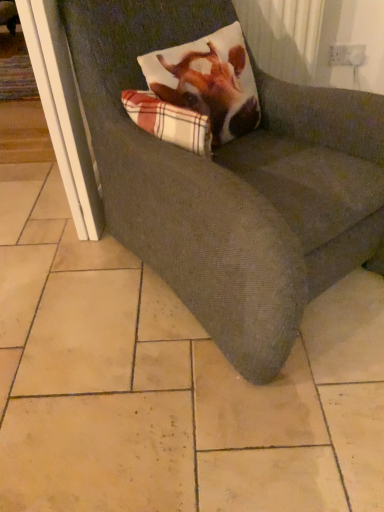
Describe the element at coordinates (169, 121) in the screenshot. I see `plaid fabric pillow at upper center` at that location.

Describe the element at coordinates (62, 112) in the screenshot. The height and width of the screenshot is (512, 384). I see `white plastic screen door at left` at that location.

In order to click on plaid fabric pillow at upper center in this screenshot , I will do `click(169, 121)`.

Are plaid fabric pillow at upper center and textured gray couch at center beside each other?

No, plaid fabric pillow at upper center is not with textured gray couch at center.

Is plaid fabric pillow at upper center to the right of textured gray couch at center from the viewer's perspective?

In fact, plaid fabric pillow at upper center is to the left of textured gray couch at center.

How many degrees apart are the facing directions of plaid fabric pillow at upper center and textured gray couch at center?

The angular difference between plaid fabric pillow at upper center and textured gray couch at center is 90 degrees.

Based on their sizes in the image, would you say plaid fabric pillow at upper center is bigger or smaller than textured gray couch at center?

In the image, plaid fabric pillow at upper center appears to be smaller than textured gray couch at center.

Are white plastic screen door at left and plaid fabric pillow at upper center located far from each other?

No, white plastic screen door at left is in close proximity to plaid fabric pillow at upper center.

Is white plastic screen door at left smaller than plaid fabric pillow at upper center?

No, white plastic screen door at left is not smaller than plaid fabric pillow at upper center.

Is point (96, 209) closer or farther from the camera than point (187, 131)?

Point (96, 209) appears to be farther away from the viewer than point (187, 131).

Is white plastic screen door at left taller or shorter than plaid fabric pillow at upper center?

white plastic screen door at left is taller than plaid fabric pillow at upper center.

Is plaid fabric pillow at upper center completely or partially outside of white plastic screen door at left?

plaid fabric pillow at upper center lies outside white plastic screen door at left's area.

Which is more to the left, plaid fabric pillow at upper center or white plastic screen door at left?

Positioned to the left is white plastic screen door at left.

Looking at their sizes, would you say plaid fabric pillow at upper center is wider or thinner than white plastic screen door at left?

plaid fabric pillow at upper center is thinner than white plastic screen door at left.

Which object is further away from the camera, plaid fabric pillow at upper center or white plastic screen door at left?

white plastic screen door at left is further from the camera.

Considering the relative sizes of white plastic screen door at left and textured gray couch at center in the image provided, is white plastic screen door at left wider than textured gray couch at center?

Incorrect, the width of white plastic screen door at left does not surpass that of textured gray couch at center.

Is white plastic screen door at left to the right of textured gray couch at center from the viewer's perspective?

In fact, white plastic screen door at left is to the left of textured gray couch at center.

From a real-world perspective, who is located lower, white plastic screen door at left or textured gray couch at center?

From a 3D spatial view, white plastic screen door at left is below.

Based on the photo, how different are the orientations of white plastic screen door at left and textured gray couch at center in degrees?

131 degrees separate the facing orientations of white plastic screen door at left and textured gray couch at center.

Which is in front, textured gray couch at center or plaid fabric pillow at upper center?

textured gray couch at center is more forward.

Is textured gray couch at center to the left of plaid fabric pillow at upper center from the viewer's perspective?

In fact, textured gray couch at center is to the right of plaid fabric pillow at upper center.

From a real-world perspective, is textured gray couch at center on plaid fabric pillow at upper center?

Incorrect, from a real-world perspective, textured gray couch at center is lower than plaid fabric pillow at upper center.

Between textured gray couch at center and plaid fabric pillow at upper center, which one has smaller width?

Thinner between the two is plaid fabric pillow at upper center.

Considering the points (234, 314) and (76, 147), which point is in front, point (234, 314) or point (76, 147)?

Positioned in front is point (234, 314).

At what (x,y) coordinates should I click in order to perform the action: click on chair in front of the white plastic screen door at left. Please return your answer as a coordinate pair (x, y). The image size is (384, 512). Looking at the image, I should click on (231, 183).

From the image's perspective, between textured gray couch at center and white plastic screen door at left, which one is located above?

white plastic screen door at left appears higher in the image.

In the image, is textured gray couch at center positioned in front of or behind white plastic screen door at left?

Clearly, textured gray couch at center is in front of white plastic screen door at left.

The image size is (384, 512). I want to click on chair on the right of plaid fabric pillow at upper center, so click(x=231, y=183).

The height and width of the screenshot is (512, 384). I want to click on screen door behind the plaid fabric pillow at upper center, so click(62, 112).

Considering their positions, is plaid fabric pillow at upper center positioned closer to white plastic screen door at left than textured gray couch at center?

Among the two, plaid fabric pillow at upper center is located nearer to white plastic screen door at left.

Looking at the image, which one is located closer to textured gray couch at center, white plastic screen door at left or plaid fabric pillow at upper center?

Among the two, plaid fabric pillow at upper center is located nearer to textured gray couch at center.

From the image, which object appears to be farther from plaid fabric pillow at upper center, textured gray couch at center or white plastic screen door at left?

Based on the image, white plastic screen door at left appears to be further to plaid fabric pillow at upper center.

From the image, which object appears to be nearer to plaid fabric pillow at upper center, white plastic screen door at left or textured gray couch at center?

Based on the image, textured gray couch at center appears to be nearer to plaid fabric pillow at upper center.

Considering their positions, is plaid fabric pillow at upper center positioned closer to textured gray couch at center than white plastic screen door at left?

plaid fabric pillow at upper center.

Estimate the real-world distances between objects in this image. Which object is further from white plastic screen door at left, textured gray couch at center or plaid fabric pillow at upper center?

textured gray couch at center.

Locate an element on the screen. Image resolution: width=384 pixels, height=512 pixels. plaid between textured gray couch at center and white plastic screen door at left along the z-axis is located at coordinates (169, 121).